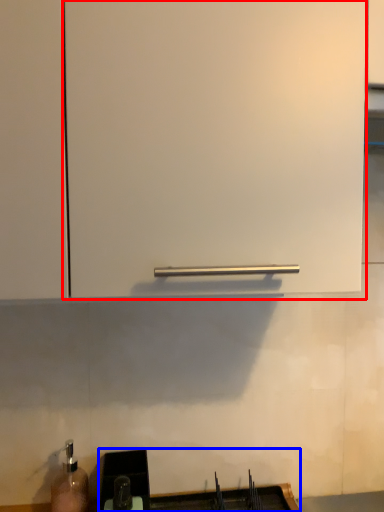
Question: Among these objects, which one is farthest to the camera, cabinetry (highlighted by a red box) or sink (highlighted by a blue box)?

Choices:
 (A) cabinetry
 (B) sink

Answer: (B)